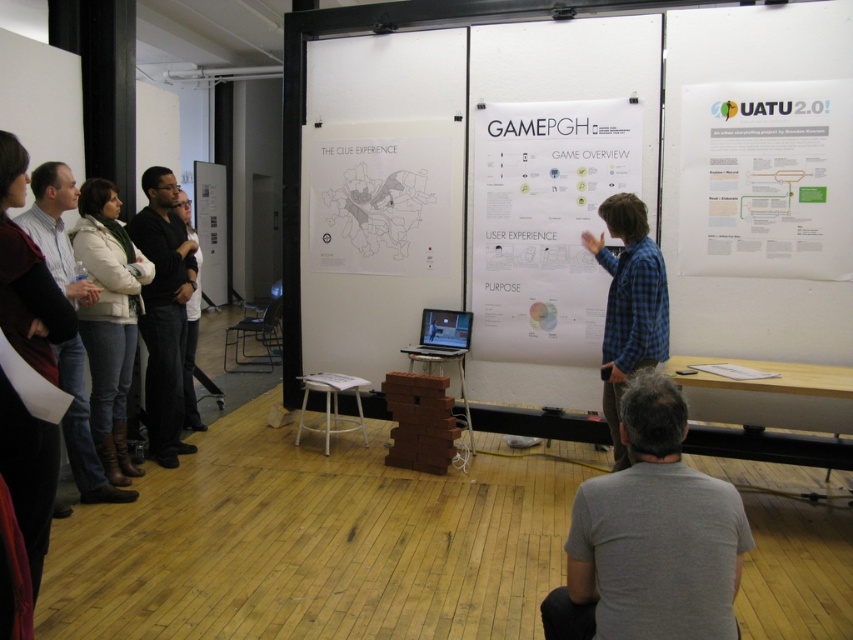
You are an attendee at the GAMEPGH presentation. You notice the white paper poster at center and the light brown leather jacket at left. Which object is shorter?

The white paper poster at center is shorter than the light brown leather jacket at left.

You are an attendee at the GAMEPGH presentation. You need to locate the white paper map at center to reference during the discussion. Where exactly is the white paper map positioned relative to the other elements in the scene?

The white paper map at center is positioned at coordinates point (380, 204), which places it centrally in the scene, likely on the table where the presenter is gesturing towards.